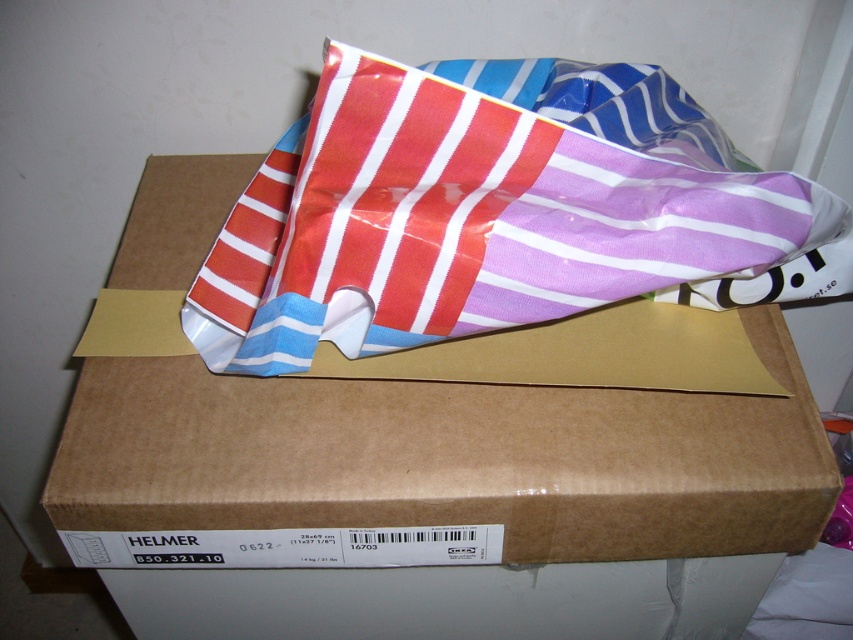
Measure the distance between point (273, 472) and camera.

A distance of 24.62 inches exists between point (273, 472) and camera.

Who is shorter, brown cardboard box at center or striped plastic bag at center?

striped plastic bag at center

Which is in front, point (262, 404) or point (503, 211)?

Point (503, 211)

I want to click on brown cardboard box at center, so click(x=450, y=496).